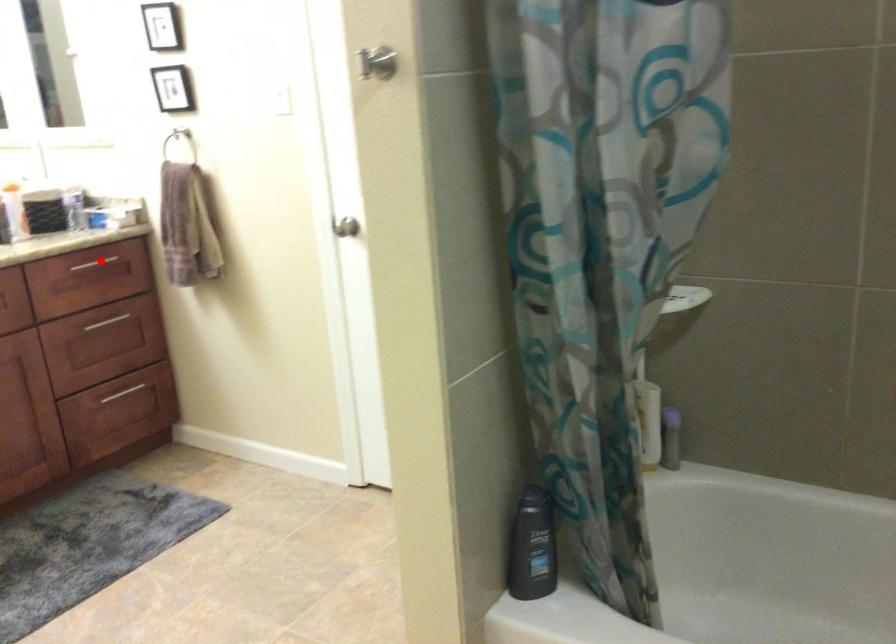
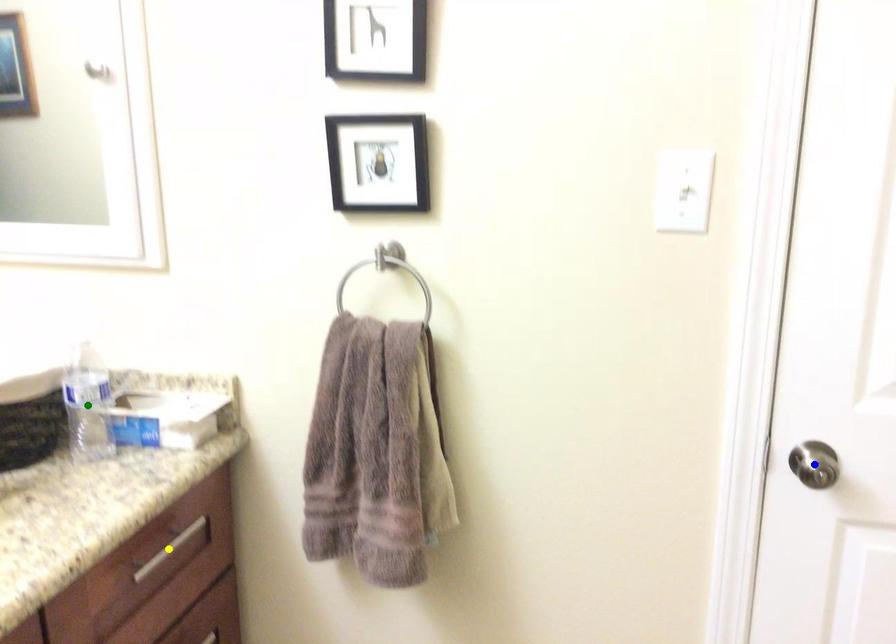
Question: I am providing you with two images of the same scene from different viewpoints. A red point is marked on the first image. You are given multiple points on the second image. Can you choose the point in image 2 that corresponds to the point in image 1?

Choices:
 (A) green point
 (B) blue point
 (C) yellow point

Answer: (C)